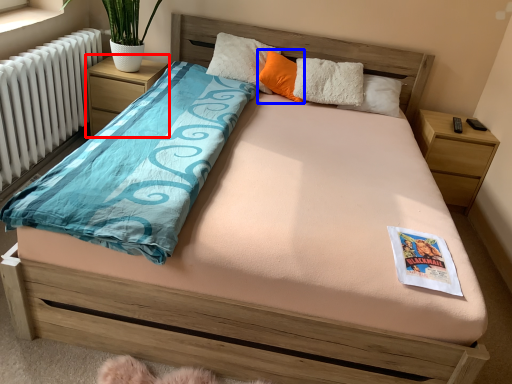
Question: Which point is closer to the camera, nightstand (highlighted by a red box) or pillow (highlighted by a blue box)?

Choices:
 (A) nightstand
 (B) pillow

Answer: (B)